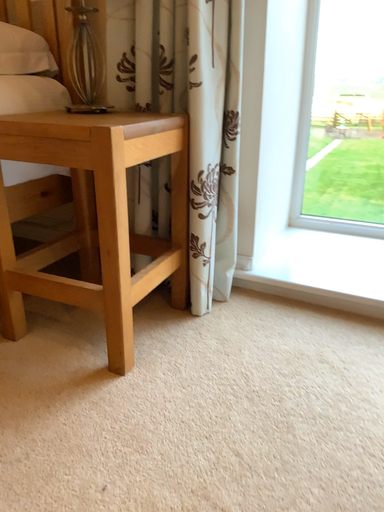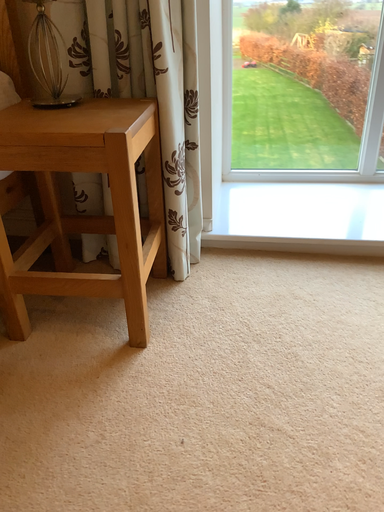
Question: How did the camera likely rotate when shooting the video?

Choices:
 (A) rotated downward
 (B) rotated upward

Answer: (A)